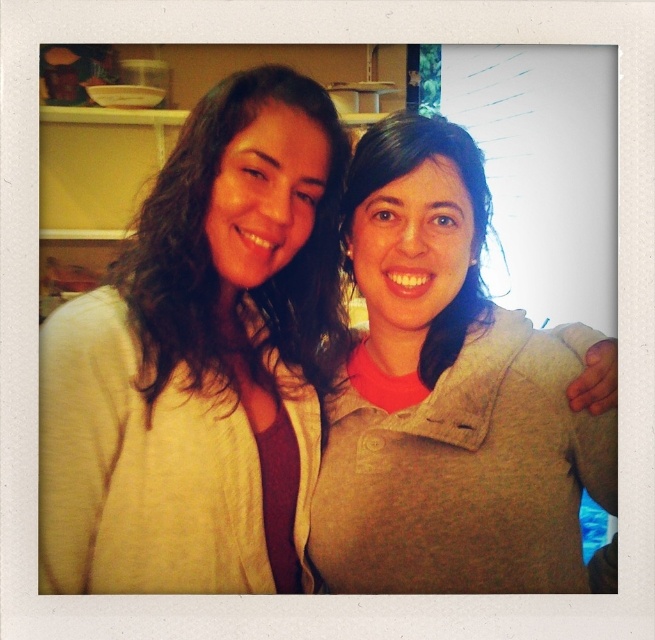
Question: Observing the image, what is the correct spatial positioning of matte white cardigan at left in reference to matte gray sweater at center?

Choices:
 (A) right
 (B) left

Answer: (B)

Question: Is matte white cardigan at left to the right of matte gray sweater at center from the viewer's perspective?

Choices:
 (A) no
 (B) yes

Answer: (A)

Question: Which point is farther to the camera?

Choices:
 (A) matte gray sweater at center
 (B) matte white cardigan at left

Answer: (A)

Question: Which point is closer to the camera taking this photo?

Choices:
 (A) (578, 579)
 (B) (136, 300)

Answer: (B)

Question: In this image, where is matte white cardigan at left located relative to matte gray sweater at center?

Choices:
 (A) right
 (B) left

Answer: (B)